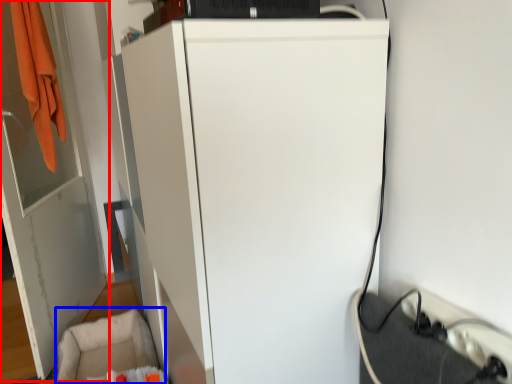
Question: Which of the following is the closest to the observer, door (highlighted by a red box) or swivel chair (highlighted by a blue box)?

Choices:
 (A) door
 (B) swivel chair

Answer: (A)